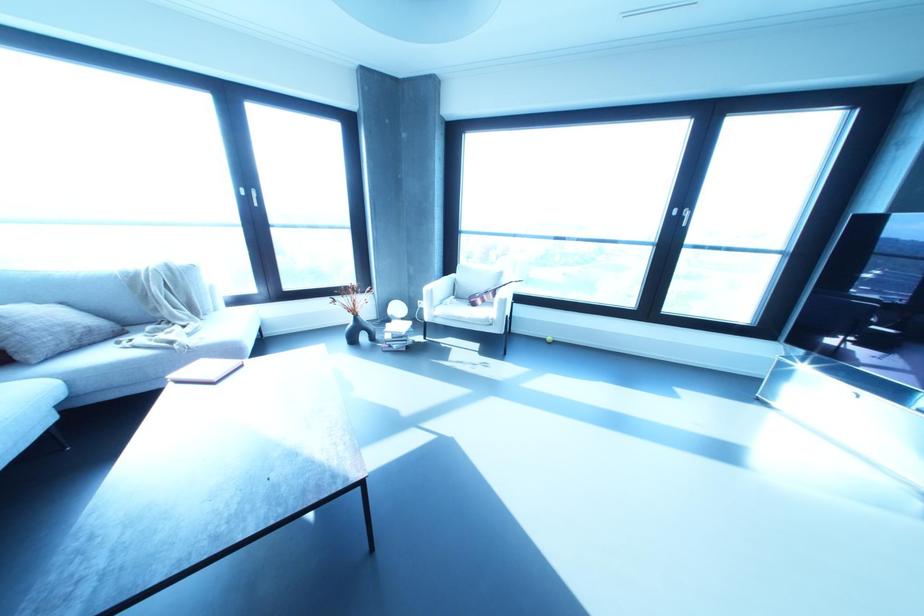
This screenshot has height=616, width=924. In order to click on gray throw pillow in this screenshot , I will do `click(50, 330)`.